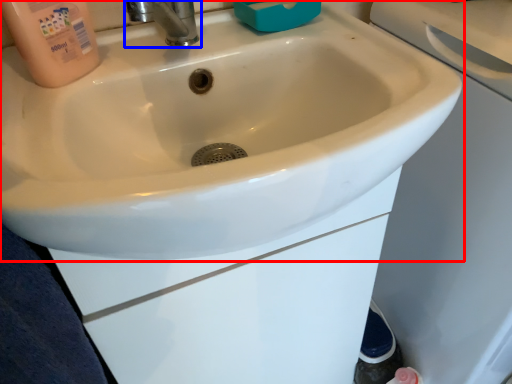
Question: Which object is closer to the camera taking this photo, sink (highlighted by a red box) or tap (highlighted by a blue box)?

Choices:
 (A) sink
 (B) tap

Answer: (A)